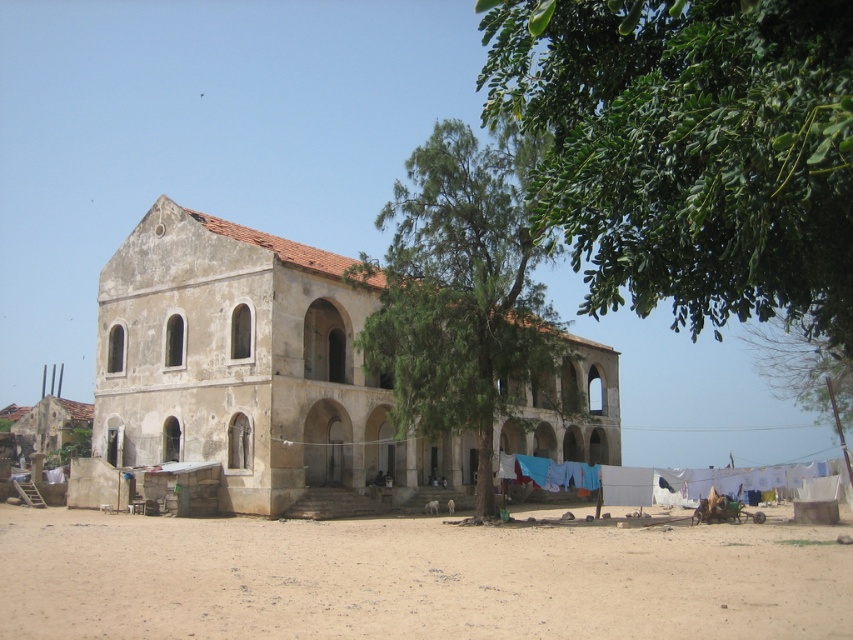
You are standing at the entrance of the two story building and want to walk directly towards the green leafy tree at center. Which direction should you head?

The green leafy tree at center is located at point (462, 292), so you should head towards the center of the image to reach it.

You are standing in front of the beige plaster church at center and the green leafy tree at center. Which object is closer to the ground?

The beige plaster church at center is closer to the ground because it is located below the green leafy tree at center.